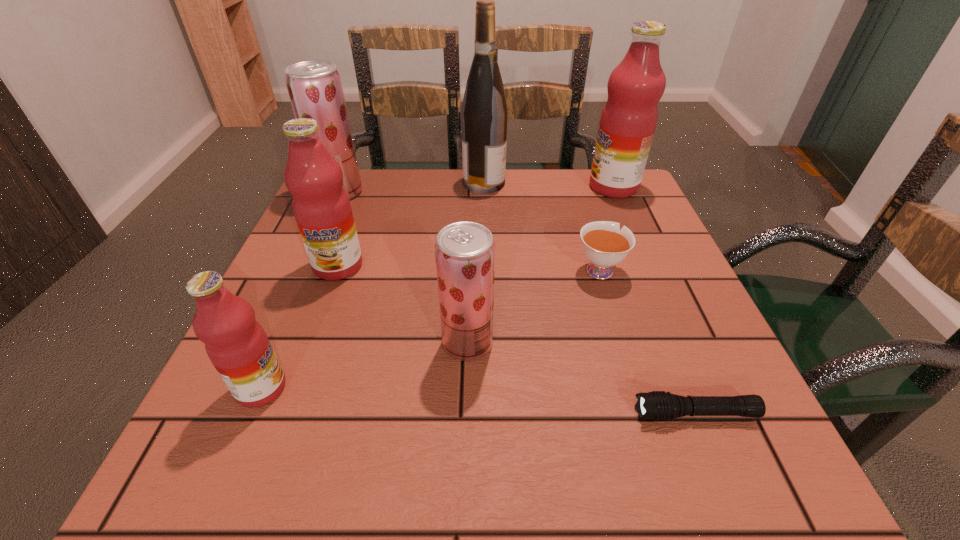
Locate an element on the screen. This screenshot has height=540, width=960. wine bottle is located at coordinates (484, 113).

The width and height of the screenshot is (960, 540). In order to click on the tallest fruit juice in this screenshot , I will do `click(628, 121)`.

At what (x,y) coordinates should I click in order to perform the action: click on the biggest pink fruit juice. Please return your answer as a coordinate pair (x, y). The height and width of the screenshot is (540, 960). Looking at the image, I should click on (628, 121).

The width and height of the screenshot is (960, 540). What are the coordinates of `the bigger strawberry fruit juice` in the screenshot? It's located at (314, 86).

Find the location of a particular element. the left strawberry fruit juice is located at coordinates (314, 86).

Locate an element on the screen. Image resolution: width=960 pixels, height=540 pixels. the second smallest pink fruit juice is located at coordinates (321, 206).

Find the location of a particular element. Image resolution: width=960 pixels, height=540 pixels. the second farthest pink fruit juice is located at coordinates (321, 206).

In order to click on the right strawberry fruit juice in this screenshot , I will do `click(465, 251)`.

Find the location of a particular element. the smaller strawberry fruit juice is located at coordinates (465, 251).

Find the location of a particular element. The width and height of the screenshot is (960, 540). the nearest fruit juice is located at coordinates (236, 344).